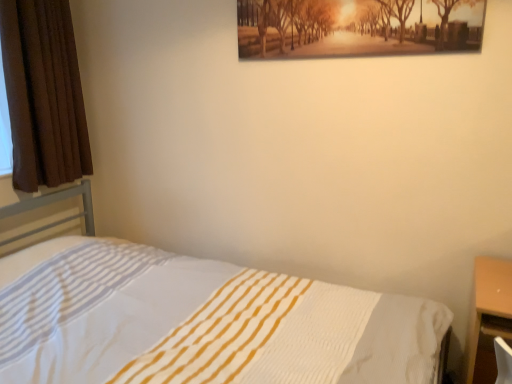
Question: Does white textured bed at center come in front of matte wooden picture frame at upper center?

Choices:
 (A) no
 (B) yes

Answer: (B)

Question: Can you confirm if white textured bed at center is wider than matte wooden picture frame at upper center?

Choices:
 (A) no
 (B) yes

Answer: (B)

Question: Can you confirm if white textured bed at center is positioned to the right of matte wooden picture frame at upper center?

Choices:
 (A) no
 (B) yes

Answer: (A)

Question: Is white textured bed at center directly adjacent to matte wooden picture frame at upper center?

Choices:
 (A) yes
 (B) no

Answer: (B)

Question: From a real-world perspective, is white textured bed at center physically above matte wooden picture frame at upper center?

Choices:
 (A) yes
 (B) no

Answer: (B)

Question: Can you confirm if white textured bed at center is bigger than matte wooden picture frame at upper center?

Choices:
 (A) yes
 (B) no

Answer: (A)

Question: Is matte wooden picture frame at upper center to the left of white textured bed at center from the viewer's perspective?

Choices:
 (A) yes
 (B) no

Answer: (B)

Question: Would you say matte wooden picture frame at upper center contains white textured bed at center?

Choices:
 (A) no
 (B) yes

Answer: (A)

Question: Is matte wooden picture frame at upper center wider than white textured bed at center?

Choices:
 (A) no
 (B) yes

Answer: (A)

Question: Are matte wooden picture frame at upper center and white textured bed at center beside each other?

Choices:
 (A) yes
 (B) no

Answer: (B)

Question: Considering the relative sizes of matte wooden picture frame at upper center and white textured bed at center in the image provided, is matte wooden picture frame at upper center smaller than white textured bed at center?

Choices:
 (A) no
 (B) yes

Answer: (B)

Question: Does matte wooden picture frame at upper center turn towards white textured bed at center?

Choices:
 (A) yes
 (B) no

Answer: (B)

Question: Is brown velvet curtain at left positioned far away from white textured bed at center?

Choices:
 (A) yes
 (B) no

Answer: (B)